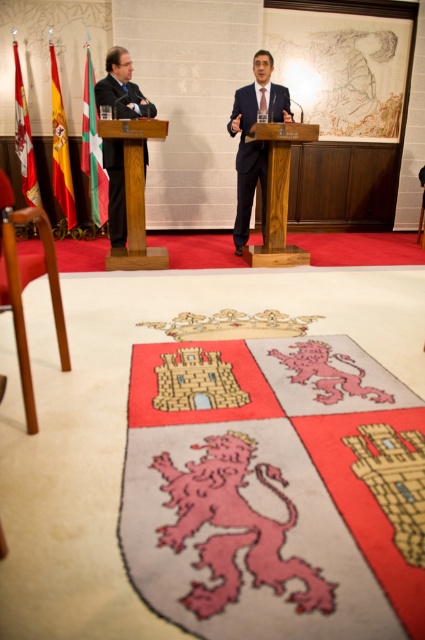
You are an event organizer who needs to ensure that all items on stage are properly spaced. Given that the matte black suit at left and the silk flag at left are both on the stage, which one has a greater width?

The matte black suit at left has a greater width than the silk flag at left according to the description.

You are attending a press conference and want to take a photo of the two points mentioned in the scene. Which point, point (102, 80) or point (22, 113), will appear larger in your photo?

Point (102, 80) will appear larger in the photo because it is closer to the viewer than point (22, 113).

You are a photographer standing at the back of the room. You want to take a closeup photo of the matte black suit at left. Given that your camera can focus up to 10 feet, will you be able to capture a clear closeup?

The matte black suit at left is 12.69 feet away from the camera, which exceeds the camera focus limit of 10 feet. Therefore, you cannot capture a clear closeup.